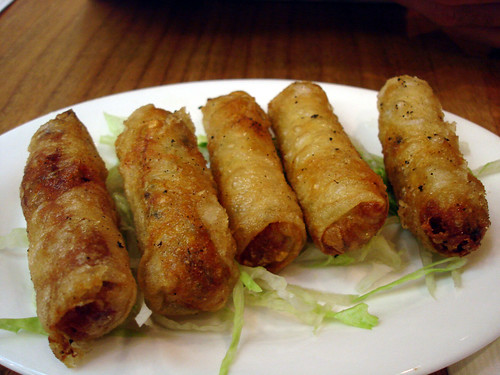
Identify the location of counter/table on shadows. This screenshot has height=375, width=500. (166, 30).